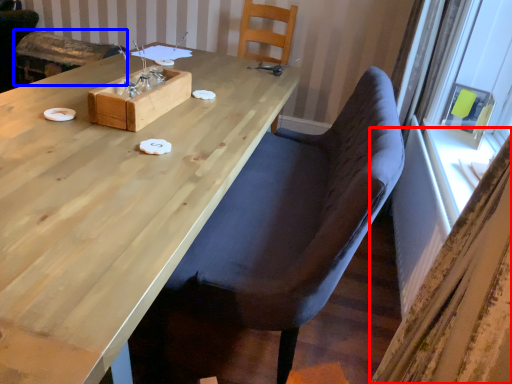
Question: Which point is further to the camera, curtain (highlighted by a red box) or armchair (highlighted by a blue box)?

Choices:
 (A) curtain
 (B) armchair

Answer: (B)